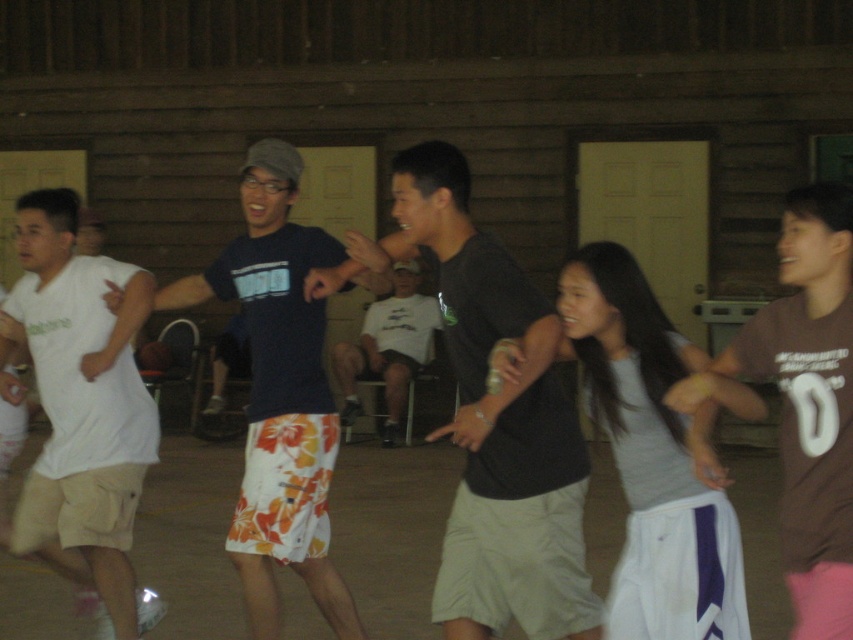
You are standing in the middle of the room and see two points marked in the scene. The first point is at coordinates point (254, 554) and the second is at point (799, 426). Which point is closer to you?

Point (254, 554) is closer to you because it is further to the viewer than point (799, 426).